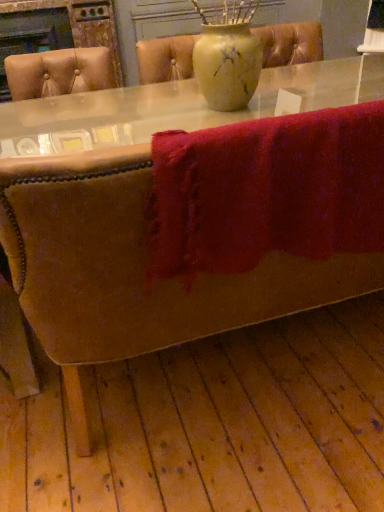
Where is `fuzzy red towel at lower center`? fuzzy red towel at lower center is located at coordinates (266, 191).

The width and height of the screenshot is (384, 512). What do you see at coordinates (266, 191) in the screenshot?
I see `fuzzy red towel at lower center` at bounding box center [266, 191].

Find the location of a particular element. This screenshot has height=512, width=384. matte yellow vase at center is located at coordinates (175, 106).

The image size is (384, 512). What do you see at coordinates (175, 106) in the screenshot?
I see `matte yellow vase at center` at bounding box center [175, 106].

Find the location of `fuzzy red towel at lower center`. fuzzy red towel at lower center is located at coordinates (266, 191).

Which object is positioned more to the left, fuzzy red towel at lower center or matte yellow vase at center?

matte yellow vase at center is more to the left.

In the image, is fuzzy red towel at lower center positioned in front of or behind matte yellow vase at center?

A: fuzzy red towel at lower center is in front of matte yellow vase at center.

Which is closer to the camera, [298,196] or [186,92]?

The point [298,196] is closer.

From the image's perspective, which one is positioned higher, fuzzy red towel at lower center or matte yellow vase at center?

From the image's view, matte yellow vase at center is above.

From a real-world perspective, relative to matte yellow vase at center, is fuzzy red towel at lower center vertically above or below?

In terms of real-world spatial position, fuzzy red towel at lower center is below matte yellow vase at center.

Can you confirm if fuzzy red towel at lower center is thinner than matte yellow vase at center?

Yes.

Is fuzzy red towel at lower center taller than matte yellow vase at center?

Indeed, fuzzy red towel at lower center has a greater height compared to matte yellow vase at center.

Between fuzzy red towel at lower center and matte yellow vase at center, which one has larger size?

matte yellow vase at center.

Is fuzzy red towel at lower center spatially inside matte yellow vase at center, or outside of it?

fuzzy red towel at lower center cannot be found inside matte yellow vase at center.

In the scene shown: Is fuzzy red towel at lower center touching matte yellow vase at center?

No, fuzzy red towel at lower center is not with matte yellow vase at center.

Is fuzzy red towel at lower center oriented towards matte yellow vase at center?

Yes, fuzzy red towel at lower center is oriented towards matte yellow vase at center.

How different are the orientations of fuzzy red towel at lower center and matte yellow vase at center in degrees?

89 degrees separate the facing orientations of fuzzy red towel at lower center and matte yellow vase at center.

The image size is (384, 512). Find the location of `bath towel below the matte yellow vase at center (from the image's perspective)`. bath towel below the matte yellow vase at center (from the image's perspective) is located at coordinates (266, 191).

In the image, is matte yellow vase at center on the left side or the right side of fuzzy red towel at lower center?

From the image, it's evident that matte yellow vase at center is to the left of fuzzy red towel at lower center.

Which object is further away from the camera, matte yellow vase at center or fuzzy red towel at lower center?

matte yellow vase at center is further away from the camera.

Is point (149, 99) less distant than point (277, 155)?

No, it is behind (277, 155).

From the image's perspective, is matte yellow vase at center on fuzzy red towel at lower center?

Correct, matte yellow vase at center appears higher than fuzzy red towel at lower center in the image.

From a real-world perspective, is matte yellow vase at center positioned under fuzzy red towel at lower center based on gravity?

No.

Is matte yellow vase at center thinner than fuzzy red towel at lower center?

In fact, matte yellow vase at center might be wider than fuzzy red towel at lower center.

From their relative heights in the image, would you say matte yellow vase at center is taller or shorter than fuzzy red towel at lower center?

Clearly, matte yellow vase at center is shorter compared to fuzzy red towel at lower center.

Who is bigger, matte yellow vase at center or fuzzy red towel at lower center?

With larger size is matte yellow vase at center.

Is matte yellow vase at center located outside fuzzy red towel at lower center?

Indeed, matte yellow vase at center is completely outside fuzzy red towel at lower center.

Is matte yellow vase at center beside fuzzy red towel at lower center?

matte yellow vase at center and fuzzy red towel at lower center are clearly separated.

Is matte yellow vase at center oriented towards fuzzy red towel at lower center?

No, matte yellow vase at center is not facing towards fuzzy red towel at lower center.

How much distance is there between matte yellow vase at center and fuzzy red towel at lower center?

They are 26.44 inches apart.

Identify the location of round table on the left of the fuzzy red towel at lower center. The height and width of the screenshot is (512, 384). (175, 106).

The width and height of the screenshot is (384, 512). In order to click on bath towel below the matte yellow vase at center (from a real-world perspective) in this screenshot , I will do `click(266, 191)`.

I want to click on bath towel in front of the matte yellow vase at center, so click(x=266, y=191).